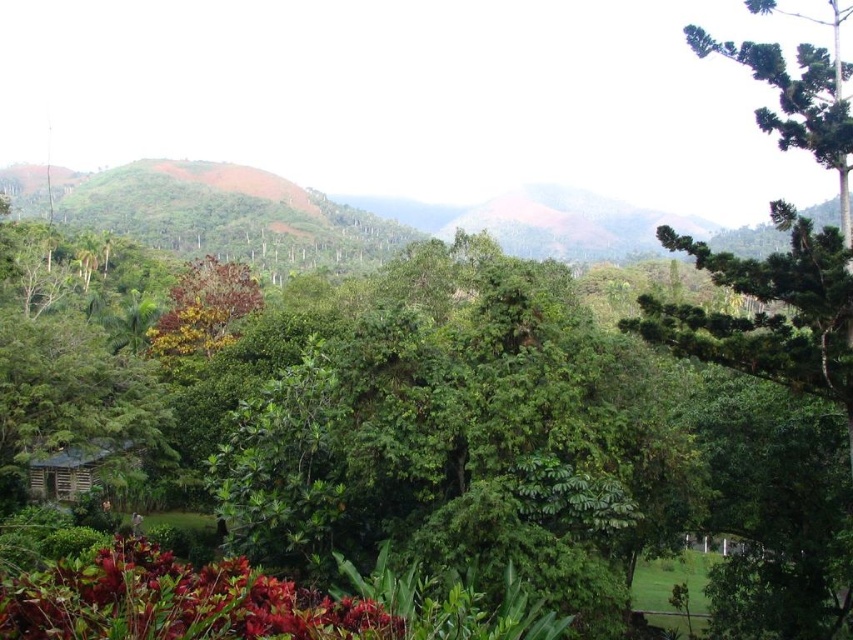
Question: In this image, where is green leafy tree at center located relative to shiny red leaves at bottom left?

Choices:
 (A) below
 (B) above

Answer: (B)

Question: Is green leafy tree at center smaller than shiny red leaves at bottom left?

Choices:
 (A) yes
 (B) no

Answer: (B)

Question: Is green leafy tree at center closer to the viewer compared to shiny red leaves at bottom left?

Choices:
 (A) no
 (B) yes

Answer: (B)

Question: Among these objects, which one is farthest from the camera?

Choices:
 (A) green leafy tree at center
 (B) shiny red leaves at bottom left

Answer: (B)